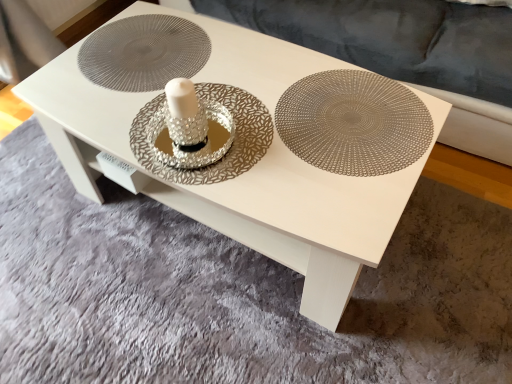
Where is `vacant space underneath metallic silver doily at center (from a real-world perspective)`? vacant space underneath metallic silver doily at center (from a real-world perspective) is located at coordinates pos(148,56).